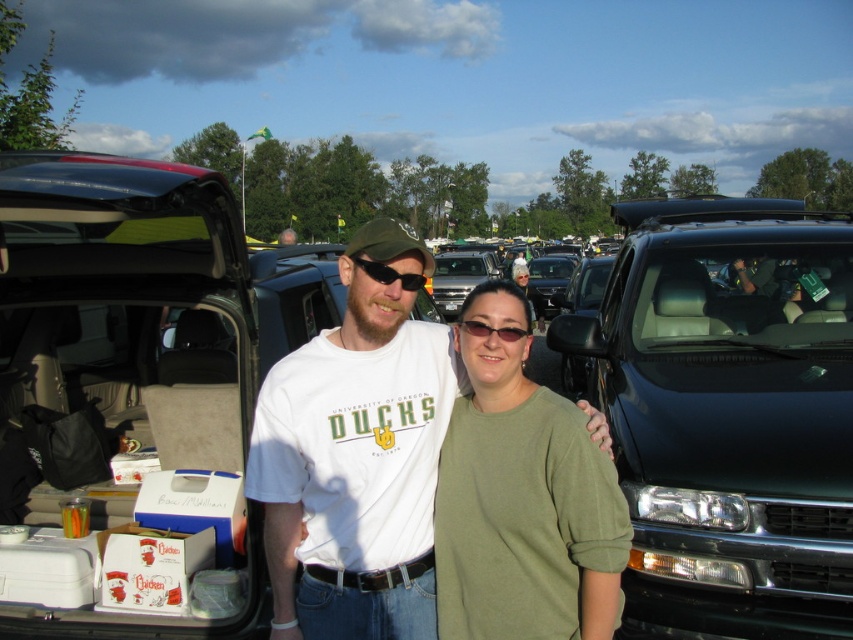
Does shiny black pickup truck at center appear on the right side of matte black sunglasses at center?

Correct, you'll find shiny black pickup truck at center to the right of matte black sunglasses at center.

Is point (659, 198) closer to viewer compared to point (508, 339)?

That is False.

Image resolution: width=853 pixels, height=640 pixels. In order to click on shiny black pickup truck at center in this screenshot , I will do `click(728, 410)`.

Describe the element at coordinates (357, 456) in the screenshot. I see `white cotton t-shirt at center` at that location.

You are a GUI agent. You are given a task and a screenshot of the screen. Output one action in this format:
    pyautogui.click(x=<x>, y=<y>)
    Task: Click on the white cotton t-shirt at center
    This screenshot has height=640, width=853.
    Given the screenshot: What is the action you would take?
    pyautogui.click(x=357, y=456)

Where is `white cotton t-shirt at center`? Image resolution: width=853 pixels, height=640 pixels. white cotton t-shirt at center is located at coordinates (357, 456).

Which of these two, white cotton t-shirt at center or matte black sunglasses at center, stands shorter?

matte black sunglasses at center

Between white cotton t-shirt at center and matte black sunglasses at center, which one appears on the left side from the viewer's perspective?

white cotton t-shirt at center is more to the left.

Locate an element on the screen. white cotton t-shirt at center is located at coordinates (357, 456).